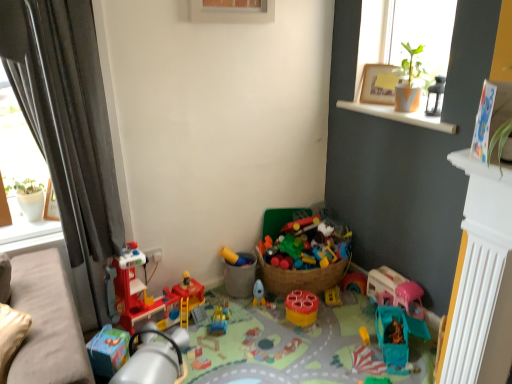
This screenshot has width=512, height=384. I want to click on free location in front of translucent plastic slide at center, placed as the 6th toy when sorted from right to left, so click(223, 342).